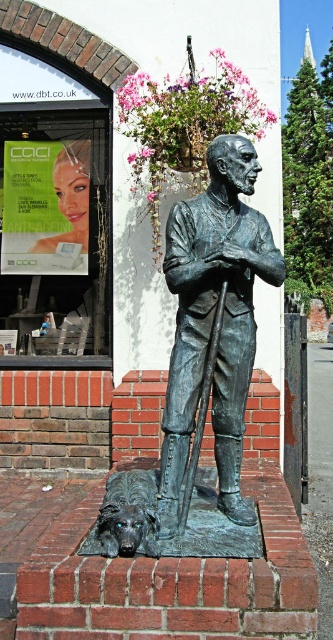
Question: Does bronze statue at center appear under shiny bronze dog at lower left?

Choices:
 (A) yes
 (B) no

Answer: (B)

Question: Is bronze statue at center positioned in front of shiny bronze dog at lower left?

Choices:
 (A) no
 (B) yes

Answer: (A)

Question: Which object is farther from the camera taking this photo?

Choices:
 (A) shiny bronze dog at lower left
 (B) bronze statue at center

Answer: (B)

Question: Does bronze statue at center appear on the right side of shiny bronze dog at lower left?

Choices:
 (A) no
 (B) yes

Answer: (B)

Question: Which point is farther to the camera?

Choices:
 (A) shiny bronze dog at lower left
 (B) bronze statue at center

Answer: (B)

Question: Which object is farther from the camera taking this photo?

Choices:
 (A) shiny bronze dog at lower left
 (B) bronze statue at center

Answer: (B)